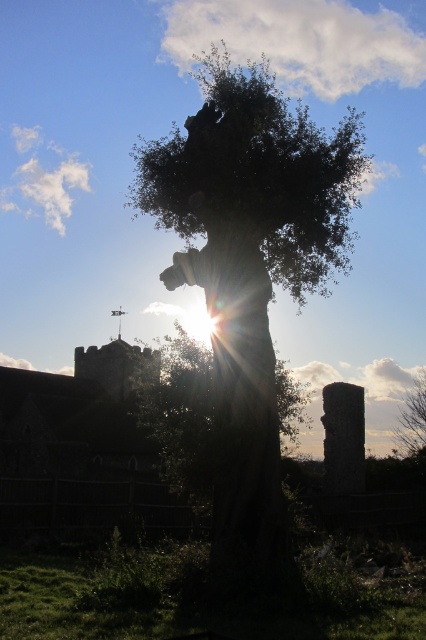
Question: Is dark green leafy tree at center bigger than green leafy tree at center?

Choices:
 (A) yes
 (B) no

Answer: (A)

Question: Among these points, which one is farthest from the camera?

Choices:
 (A) (281, 125)
 (B) (409, 429)

Answer: (B)

Question: Which object is closer to the camera taking this photo?

Choices:
 (A) dark green leafy tree at center
 (B) green leafy tree at center

Answer: (A)

Question: From the image, what is the correct spatial relationship of dark green leafy tree at center in relation to green leafy tree at center?

Choices:
 (A) right
 (B) left

Answer: (B)

Question: Can you confirm if dark green leafy tree at center is thinner than green leafy tree at center?

Choices:
 (A) yes
 (B) no

Answer: (B)